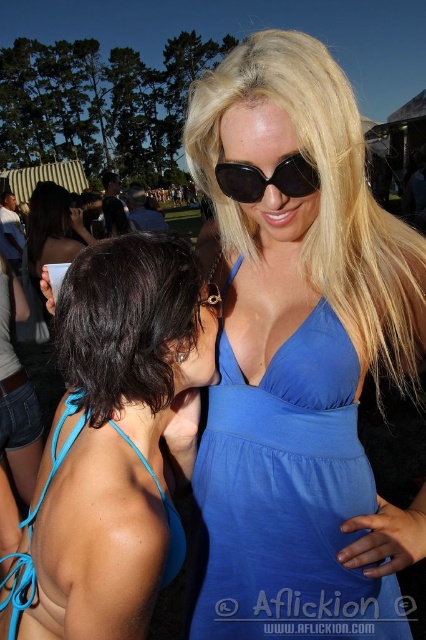
You are a photographer at the festival and want to capture a candid shot of both the blue fabric bikini top at left and the blue fabric dress at center in the same frame. The camera has a maximum focus range of 25 centimeters. Will you be able to capture both items clearly in the photo?

The blue fabric bikini top at left and the blue fabric dress at center are 28.83 centimeters apart. Since the distance between them exceeds the camera maximum focus range of 25 centimeters, you will not be able to capture both items clearly in the same frame.

You are a photographer at the festival trying to capture the two women. You notice the shiny dark hair at center and the black matte sunglasses at center. Which object is positioned closer to your camera lens?

The shiny dark hair at center is closer to the viewer than the black matte sunglasses at center, so the shiny dark hair at center would be closer to your camera lens.